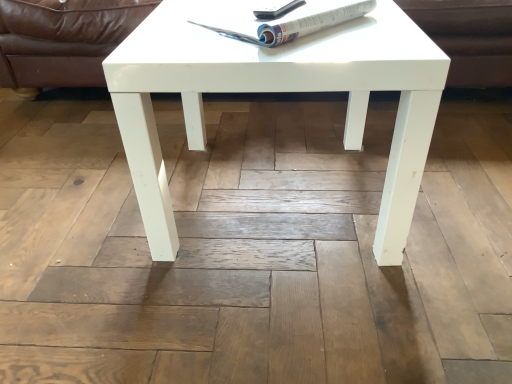
Where is `white glossy coffee table at center`? Image resolution: width=512 pixels, height=384 pixels. white glossy coffee table at center is located at coordinates (276, 91).

This screenshot has width=512, height=384. Describe the element at coordinates (63, 39) in the screenshot. I see `brown leather couch at upper center` at that location.

Identify the location of white glossy coffee table at center. (276, 91).

Considering the sizes of objects white glossy coffee table at center and brown leather couch at upper center in the image provided, who is bigger, white glossy coffee table at center or brown leather couch at upper center?

brown leather couch at upper center is bigger.

Can you confirm if white glossy coffee table at center is wider than brown leather couch at upper center?

Incorrect, the width of white glossy coffee table at center does not surpass that of brown leather couch at upper center.

How distant is white glossy coffee table at center from brown leather couch at upper center?

They are 29.58 inches apart.

Is white glossy coffee table at center looking in the opposite direction of brown leather couch at upper center?

That's not correct — white glossy coffee table at center is not looking away from brown leather couch at upper center.

From the image's perspective, is brown leather couch at upper center located above white glossy magazine at upper center?

Yes, from the image's perspective, brown leather couch at upper center is on top of white glossy magazine at upper center.

Are brown leather couch at upper center and white glossy magazine at upper center located far from each other?

No, brown leather couch at upper center is not far from white glossy magazine at upper center.

Is brown leather couch at upper center completely or partially outside of white glossy magazine at upper center?

brown leather couch at upper center is positioned outside white glossy magazine at upper center.

Looking at this image, between white glossy magazine at upper center and brown leather couch at upper center, which one has smaller width?

With smaller width is white glossy magazine at upper center.

Does white glossy magazine at upper center have a smaller size compared to brown leather couch at upper center?

Yes.

Is brown leather couch at upper center completely or partially inside white glossy magazine at upper center?

That's incorrect, brown leather couch at upper center is not inside white glossy magazine at upper center.

Based on their positions, is white glossy magazine at upper center located to the left or right of brown leather couch at upper center?

From the image, it's evident that white glossy magazine at upper center is to the left of brown leather couch at upper center.

From a real-world perspective, does white glossy magazine at upper center stand above white glossy coffee table at center?

Yes, from a real-world perspective, white glossy magazine at upper center is on top of white glossy coffee table at center.

Is white glossy magazine at upper center turned away from white glossy coffee table at center?

No, white glossy magazine at upper center's orientation is not away from white glossy coffee table at center.

Is point (284, 22) positioned before point (322, 90)?

No, (284, 22) is behind (322, 90).

Is white glossy magazine at upper center next to white glossy coffee table at center?

No.

Is white glossy coffee table at center behind white glossy magazine at upper center?

No, it is in front of white glossy magazine at upper center.

In terms of height, does white glossy coffee table at center look taller or shorter compared to white glossy magazine at upper center?

In the image, white glossy coffee table at center appears to be taller than white glossy magazine at upper center.

Would you say white glossy coffee table at center is a long distance from white glossy magazine at upper center?

No.

Can you tell me how much white glossy coffee table at center and white glossy magazine at upper center differ in facing direction?

The angle between the facing direction of white glossy coffee table at center and the facing direction of white glossy magazine at upper center is 46.6 degrees.

Are brown leather couch at upper center and white glossy coffee table at center beside each other?

No, brown leather couch at upper center is not making contact with white glossy coffee table at center.

Is brown leather couch at upper center facing away from white glossy coffee table at center?

Yes, brown leather couch at upper center is positioned with its back facing white glossy coffee table at center.

Which object is positioned more to the left, brown leather couch at upper center or white glossy coffee table at center?

Positioned to the left is white glossy coffee table at center.

This screenshot has width=512, height=384. Identify the location of couch behind the white glossy coffee table at center. (63, 39).

The height and width of the screenshot is (384, 512). I want to click on coffee table that appears below the brown leather couch at upper center (from the image's perspective), so click(276, 91).

This screenshot has height=384, width=512. I want to click on couch above the white glossy magazine at upper center (from the image's perspective), so click(x=63, y=39).

Based on their spatial positions, is white glossy magazine at upper center or white glossy coffee table at center closer to brown leather couch at upper center?

white glossy magazine at upper center.

Which object lies further to the anchor point white glossy coffee table at center, brown leather couch at upper center or white glossy magazine at upper center?

Based on the image, brown leather couch at upper center appears to be further to white glossy coffee table at center.

From the image, which object appears to be nearer to white glossy coffee table at center, white glossy magazine at upper center or brown leather couch at upper center?

The object closer to white glossy coffee table at center is white glossy magazine at upper center.

From the image, which object appears to be farther from brown leather couch at upper center, white glossy coffee table at center or white glossy magazine at upper center?

Based on the image, white glossy coffee table at center appears to be further to brown leather couch at upper center.

Looking at this image, based on their spatial positions, is white glossy coffee table at center or brown leather couch at upper center closer to white glossy magazine at upper center?

Based on the image, white glossy coffee table at center appears to be nearer to white glossy magazine at upper center.

Considering their positions, is brown leather couch at upper center positioned closer to white glossy magazine at upper center than white glossy coffee table at center?

white glossy coffee table at center is positioned closer to the anchor white glossy magazine at upper center.

Where is `magazine between white glossy coffee table at center and brown leather couch at upper center in the front-back direction`? This screenshot has height=384, width=512. magazine between white glossy coffee table at center and brown leather couch at upper center in the front-back direction is located at coordinates (293, 21).